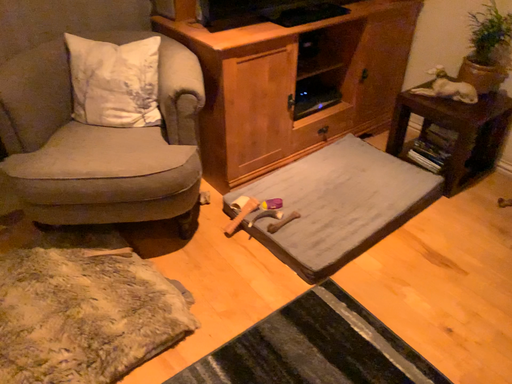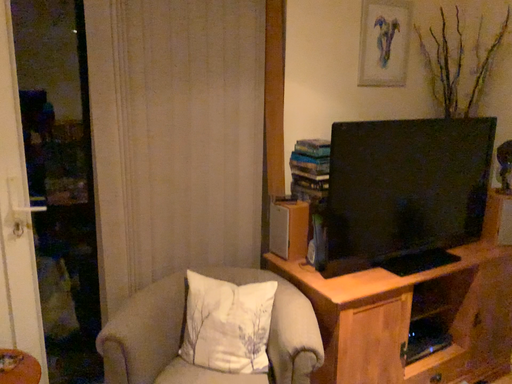
Question: How did the camera likely rotate when shooting the video?

Choices:
 (A) rotated right
 (B) rotated left

Answer: (B)